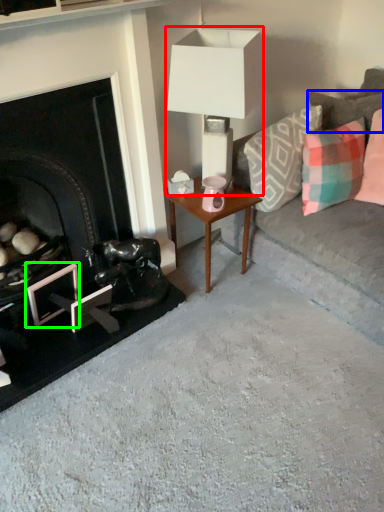
Question: Based on their relative distances, which object is nearer to table lamp (highlighted by a red box)? Choose from pillow (highlighted by a blue box) and picture frame (highlighted by a green box).

Choices:
 (A) pillow
 (B) picture frame

Answer: (A)